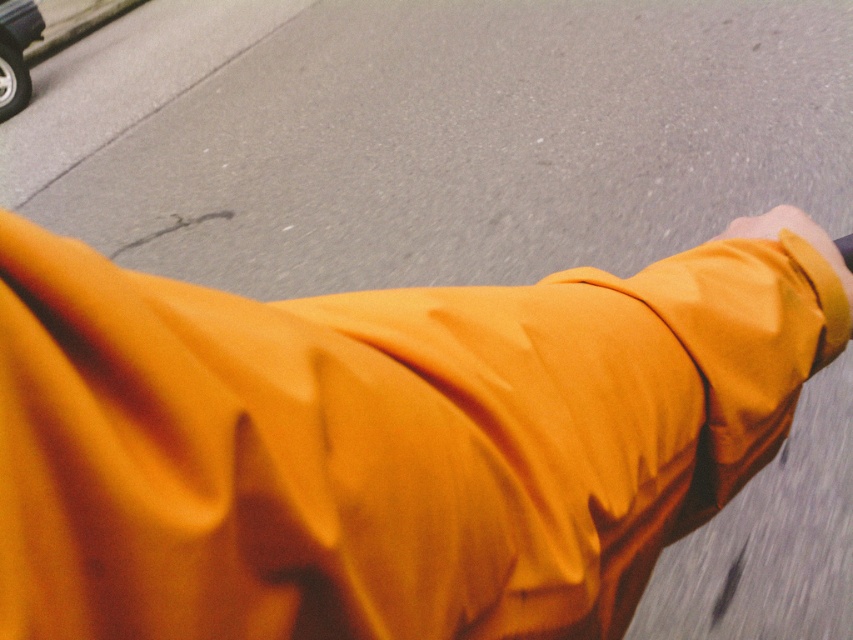
You are a pedestrian standing at the intersection. You see a matte orange robe at center and a shiny silver car at upper left. The traffic light is green for your direction. Can you safely cross the road without stopping?

The distance between the matte orange robe at center and the shiny silver car at upper left is 25.13 feet. Since the traffic light is green, you can safely cross the road without stopping as there is enough distance between the two objects.